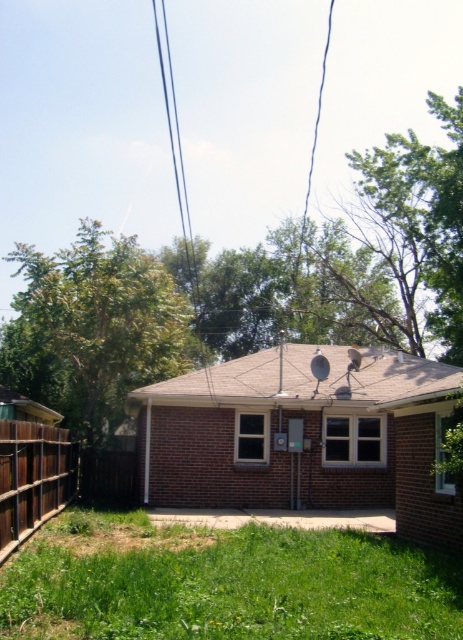
You are trying to determine the best material to reinforce the structure between the brown wooden fence at lower left and the black wire at upper center. Which object requires a thicker material for reinforcement?

The black wire at upper center requires a thicker material for reinforcement since it is thicker than the brown wooden fence at lower left.